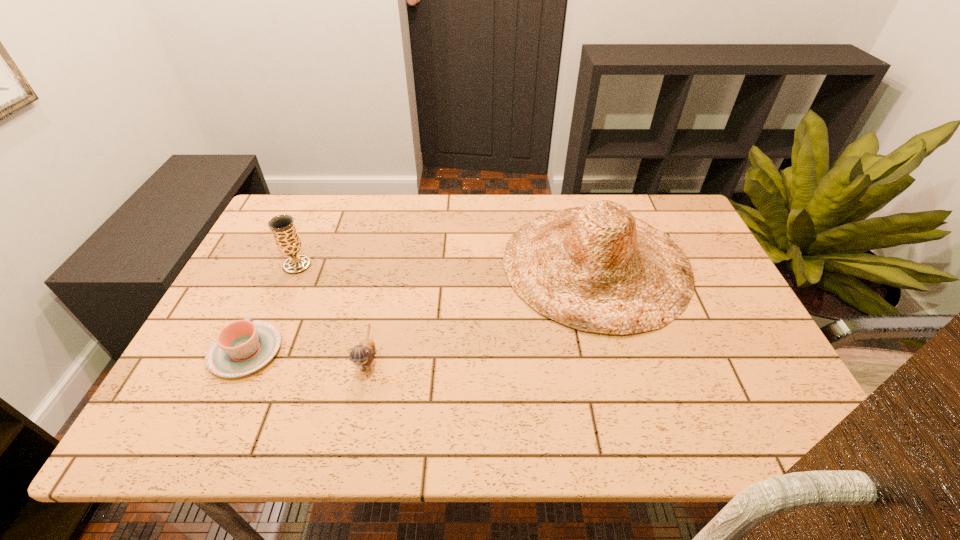
Locate an element on the screen. The image size is (960, 540). blank region between the second tallest object and the rightmost object is located at coordinates (446, 265).

Where is `unoccupied area between the rightmost object and the kitten`? unoccupied area between the rightmost object and the kitten is located at coordinates (482, 311).

In order to click on empty location between the shortest object and the sunhat in this screenshot , I will do pyautogui.click(x=420, y=307).

Locate which object is the third closest to the shortest object. Please provide its 2D coordinates. Your answer should be formatted as a tuple, i.e. [(x, y)], where the tuple contains the x and y coordinates of a point satisfying the conditions above.

[(596, 268)]

You are a GUI agent. You are given a task and a screenshot of the screen. Output one action in this format:
    pyautogui.click(x=<x>, y=<y>)
    Task: Click on the object that is the third closest to the shortest object
    The height and width of the screenshot is (540, 960).
    Given the screenshot: What is the action you would take?
    pyautogui.click(x=596, y=268)

Where is `vacant region that satisfies the following two spatial constraints: 1. on the handle side of the chinaware; 2. on the right side of the sunhat`? The height and width of the screenshot is (540, 960). vacant region that satisfies the following two spatial constraints: 1. on the handle side of the chinaware; 2. on the right side of the sunhat is located at coordinates (287, 264).

The image size is (960, 540). I want to click on vacant space that satisfies the following two spatial constraints: 1. on the handle side of the shortest object; 2. on the right side of the rightmost object, so click(287, 264).

Image resolution: width=960 pixels, height=540 pixels. Identify the location of free location that satisfies the following two spatial constraints: 1. on the handle side of the sunhat; 2. on the right side of the shortest object. (287, 264).

Locate an element on the screen. free spot that satisfies the following two spatial constraints: 1. on the handle side of the chalice; 2. on the left side of the shortest object is located at coordinates (286, 265).

This screenshot has height=540, width=960. Find the location of `vacant space that satisfies the following two spatial constraints: 1. on the back side of the chalice; 2. on the left side of the sunhat`. vacant space that satisfies the following two spatial constraints: 1. on the back side of the chalice; 2. on the left side of the sunhat is located at coordinates (298, 264).